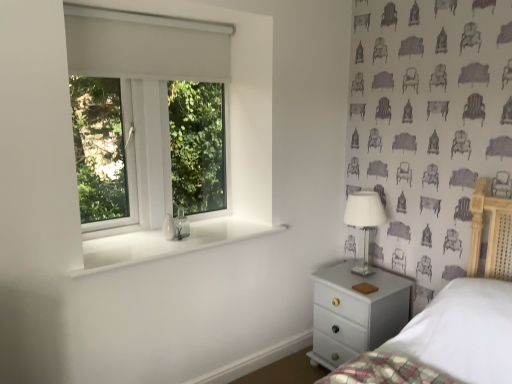
This screenshot has height=384, width=512. Find the location of `free space below white glass table lamp at right (from a real-world perspective)`. free space below white glass table lamp at right (from a real-world perspective) is located at coordinates (362, 270).